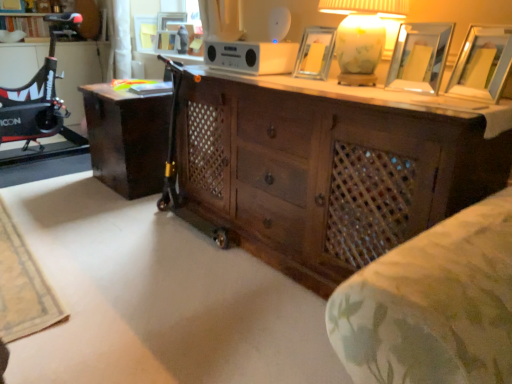
Question: Relative to metallic silver picture frame at upper right, arranged as the second picture frame when viewed from the right, is dark wood chest of drawers at center in front or behind?

Choices:
 (A) front
 (B) behind

Answer: (A)

Question: Based on their positions, is dark wood chest of drawers at center located to the left or right of metallic silver picture frame at upper right, arranged as the second picture frame when viewed from the right?

Choices:
 (A) left
 (B) right

Answer: (A)

Question: Which object is positioned closest to the wooden picture frame at upper right, acting as the 1th picture frame starting from the bottom?

Choices:
 (A) matte glass table lamp at upper right
 (B) dark wood chest of drawers at center
 (C) dark wood desk at center
 (D) metallic silver picture frame at upper center, which ranks as the 3th picture frame in top-to-bottom order
 (E) matte white picture frame at upper center, marked as the first picture frame in a left-to-right arrangement

Answer: (A)

Question: Based on their relative distances, which object is farther from the wooden picture frame at upper center, which is counted as the second picture frame, starting from the back?

Choices:
 (A) dark wood desk at center
 (B) matte glass table lamp at upper right
 (C) metallic silver picture frame at upper center, placed as the third picture frame when sorted from back to front
 (D) dark wood chest of drawers at center
 (E) matte white picture frame at upper center, the first picture frame in the back-to-front sequence

Answer: (B)